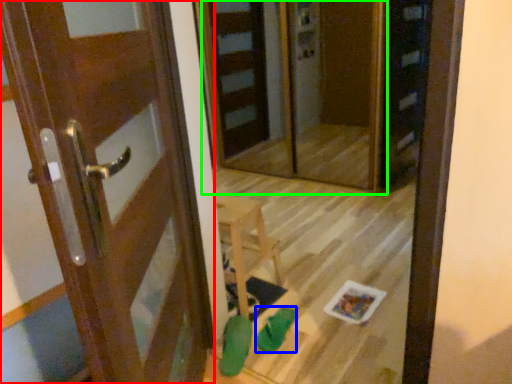
Question: Which is nearer to the door (highlighted by a red box)? shoe (highlighted by a blue box) or screen door (highlighted by a green box).

Choices:
 (A) shoe
 (B) screen door

Answer: (A)